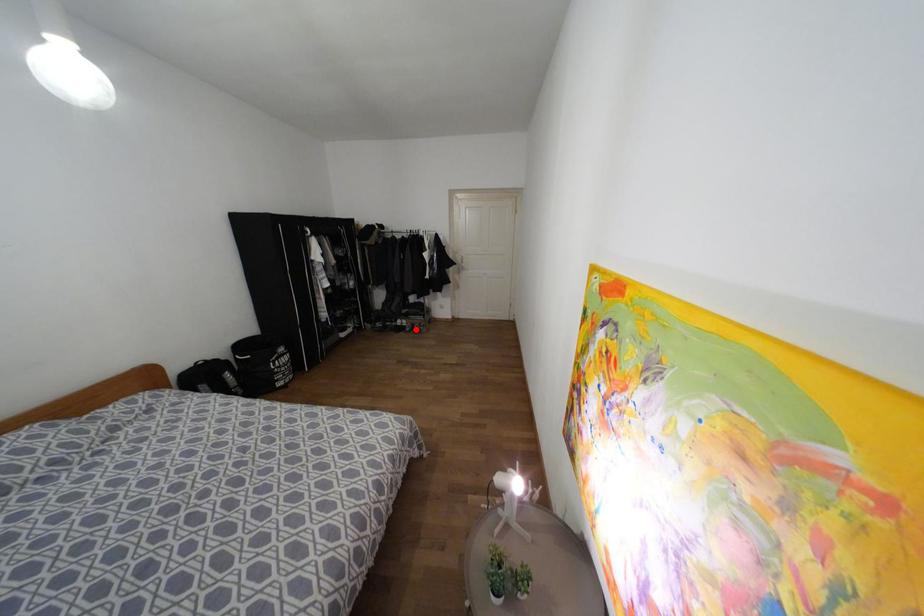
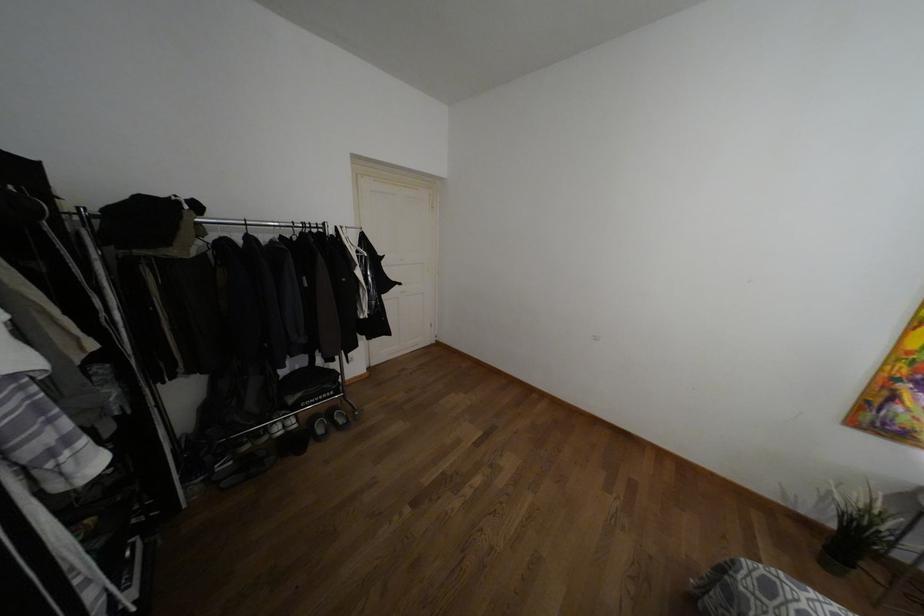
Question: I am providing you with two images of the same scene from different viewpoints. A red point is shown in image1. For the corresponding object point in image2, is it positioned nearer or farther from the camera?

Choices:
 (A) Nearer
 (B) Farther

Answer: (B)